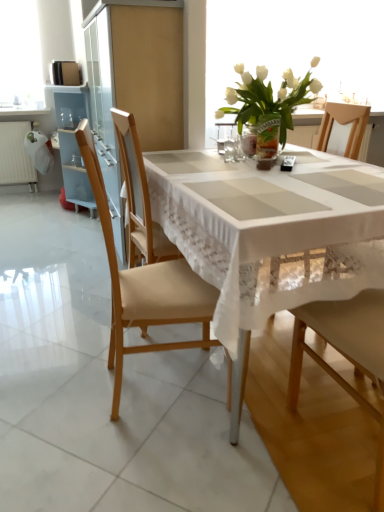
At what (x,y) coordinates should I click in order to perform the action: click on free space to the left of translucent glass vase at center, which appears as the 2th tableware when viewed from the right. Please return your answer as a coordinate pair (x, y). This screenshot has height=512, width=384. Looking at the image, I should click on (194, 159).